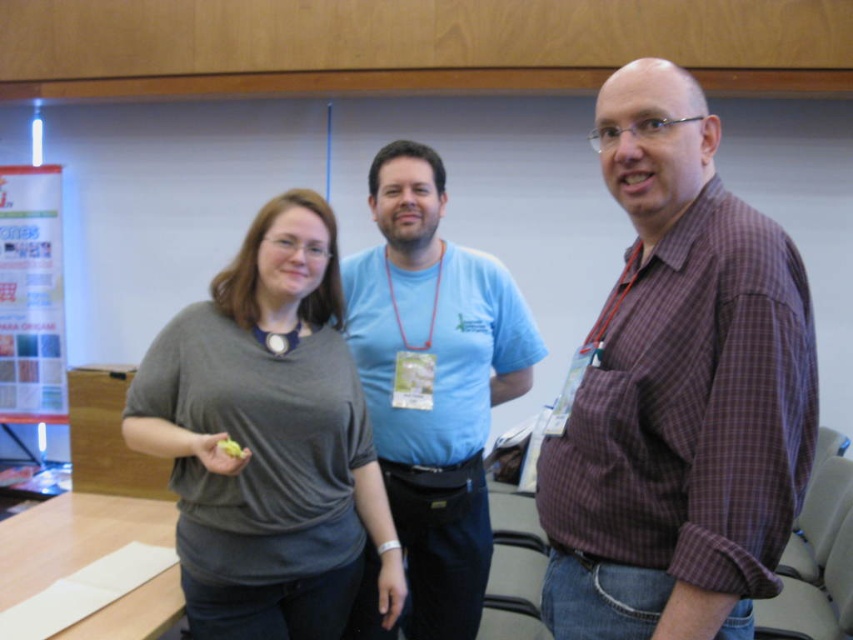
Is purple checkered shirt at right to the left of gray matte shirt at center from the viewer's perspective?

In fact, purple checkered shirt at right is to the right of gray matte shirt at center.

This screenshot has width=853, height=640. In order to click on purple checkered shirt at right in this screenshot , I will do pyautogui.click(x=680, y=392).

Which is behind, point (602, 637) or point (422, 172)?

Positioned behind is point (422, 172).

Can you confirm if purple checkered shirt at right is positioned to the right of blue cotton t-shirt at center?

Yes, purple checkered shirt at right is to the right of blue cotton t-shirt at center.

This screenshot has height=640, width=853. What are the coordinates of `purple checkered shirt at right` in the screenshot? It's located at (680, 392).

Does gray matte shirt at center have a greater height compared to blue cotton t-shirt at center?

No.

Does gray matte shirt at center have a lesser height compared to blue cotton t-shirt at center?

Yes, gray matte shirt at center is shorter than blue cotton t-shirt at center.

Between point (381, 522) and point (460, 516), which one is positioned in front?

Positioned in front is point (381, 522).

The height and width of the screenshot is (640, 853). I want to click on gray matte shirt at center, so click(x=268, y=440).